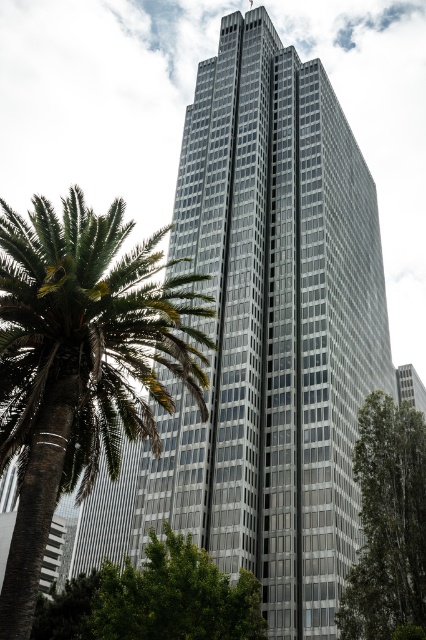
Question: Estimate the real-world distances between objects in this image. Which object is farther from the green leafy tree at right?

Choices:
 (A) green leafy palm tree at left
 (B) green leafy tree at center

Answer: (A)

Question: Is green leafy palm tree at left to the right of green leafy tree at center from the viewer's perspective?

Choices:
 (A) no
 (B) yes

Answer: (A)

Question: Does green leafy palm tree at left appear on the left side of green leafy tree at center?

Choices:
 (A) no
 (B) yes

Answer: (B)

Question: Among these objects, which one is farthest from the camera?

Choices:
 (A) green leafy tree at right
 (B) green leafy tree at center

Answer: (A)

Question: Which point is closer to the camera?

Choices:
 (A) (363, 502)
 (B) (238, 634)

Answer: (B)

Question: Does green leafy palm tree at left have a smaller size compared to green leafy tree at center?

Choices:
 (A) yes
 (B) no

Answer: (B)